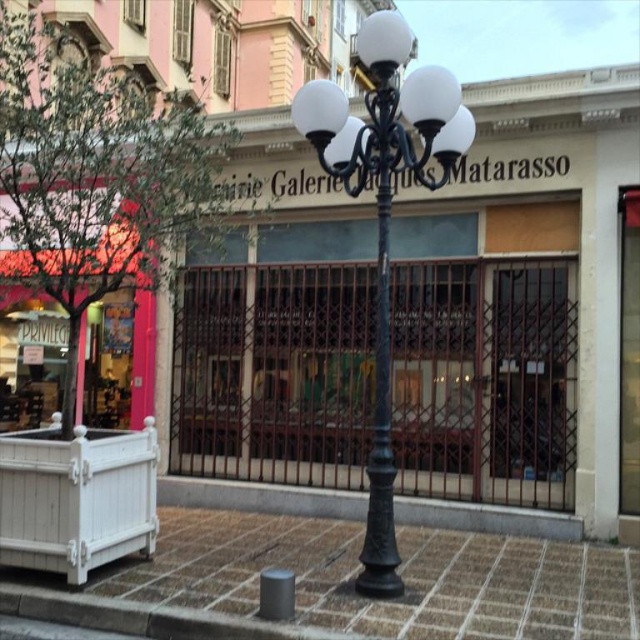
Between point (378, 204) and point (378, 58), which one is positioned in front?

Point (378, 58)

Is black metal street light at center above black metal streetlight at center?

Actually, black metal street light at center is below black metal streetlight at center.

You are a GUI agent. You are given a task and a screenshot of the screen. Output one action in this format:
    pyautogui.click(x=<x>, y=<y>)
    Task: Click on the black metal street light at center
    This screenshot has width=640, height=640.
    Given the screenshot: What is the action you would take?
    pyautogui.click(x=385, y=216)

Is brick paved sidewalk at center behind black metal streetlight at center?

Yes, it is.

Is point (166, 593) closer to viewer compared to point (368, 124)?

Yes.

The width and height of the screenshot is (640, 640). Describe the element at coordinates (401, 572) in the screenshot. I see `brick paved sidewalk at center` at that location.

The height and width of the screenshot is (640, 640). I want to click on brick paved sidewalk at center, so click(x=401, y=572).

Locate an element on the screen. This screenshot has height=640, width=640. brick paved sidewalk at center is located at coordinates (401, 572).

Is point (406, 628) more distant than point (374, 97)?

No, (406, 628) is closer to viewer.

Does point (227, 524) come closer to viewer compared to point (374, 438)?

No, it is not.

Locate an element on the screen. The image size is (640, 640). brick paved sidewalk at center is located at coordinates (401, 572).